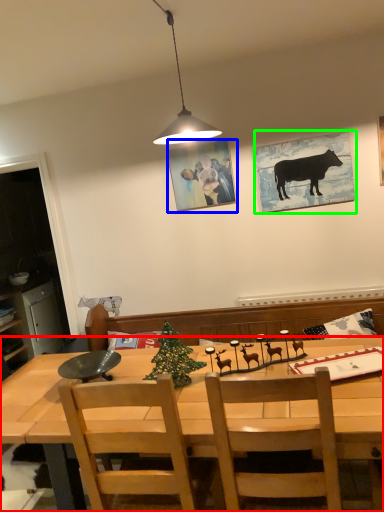
Question: Estimate the real-world distances between objects in this image. Which object is closer to desk (highlighted by a red box), picture frame (highlighted by a blue box) or picture frame (highlighted by a green box)?

Choices:
 (A) picture frame
 (B) picture frame

Answer: (B)